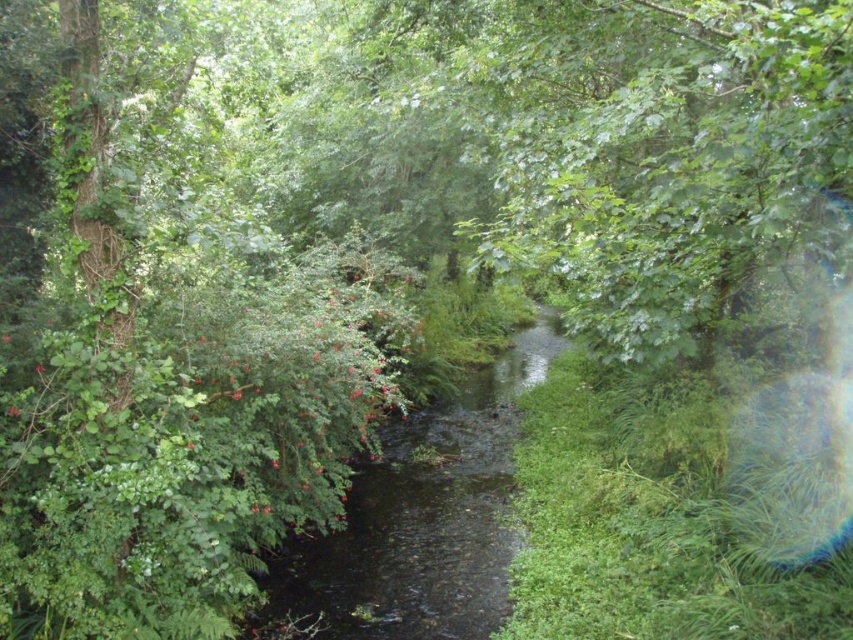
Which is more to the right, green matte bush at center-left or glossy red flower at center-left?

green matte bush at center-left

Does point (305, 404) lie behind point (16, 413)?

Yes, point (305, 404) is behind point (16, 413).

The height and width of the screenshot is (640, 853). Find the location of `green matte bush at center-left`. green matte bush at center-left is located at coordinates (296, 390).

Does green leafy stream at center appear over glossy red flower at center-left?

No.

Is green leafy stream at center shorter than glossy red flower at center-left?

No, green leafy stream at center is not shorter than glossy red flower at center-left.

The height and width of the screenshot is (640, 853). I want to click on green leafy stream at center, so click(422, 518).

Where is `green leafy stream at center`? The width and height of the screenshot is (853, 640). green leafy stream at center is located at coordinates (422, 518).

Consider the image. Who is shorter, green leafy stream at center or glossy red flower at left?

glossy red flower at left is shorter.

Is green leafy stream at center further to the viewer compared to glossy red flower at left?

Yes, it is behind glossy red flower at left.

Is point (498, 417) more distant than point (44, 369)?

Yes, it is behind point (44, 369).

The height and width of the screenshot is (640, 853). What are the coordinates of `green leafy stream at center` in the screenshot? It's located at (422, 518).